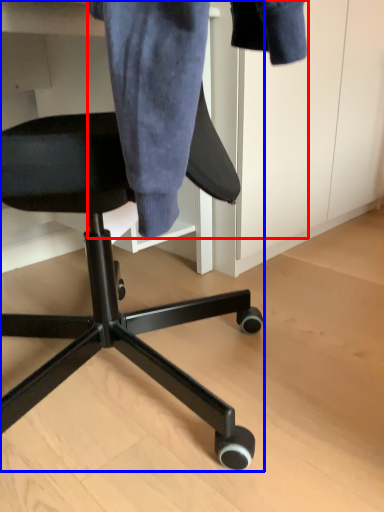
Question: Which of the following is the farthest to the observer, denim jacket (highlighted by a red box) or chair (highlighted by a blue box)?

Choices:
 (A) denim jacket
 (B) chair

Answer: (A)